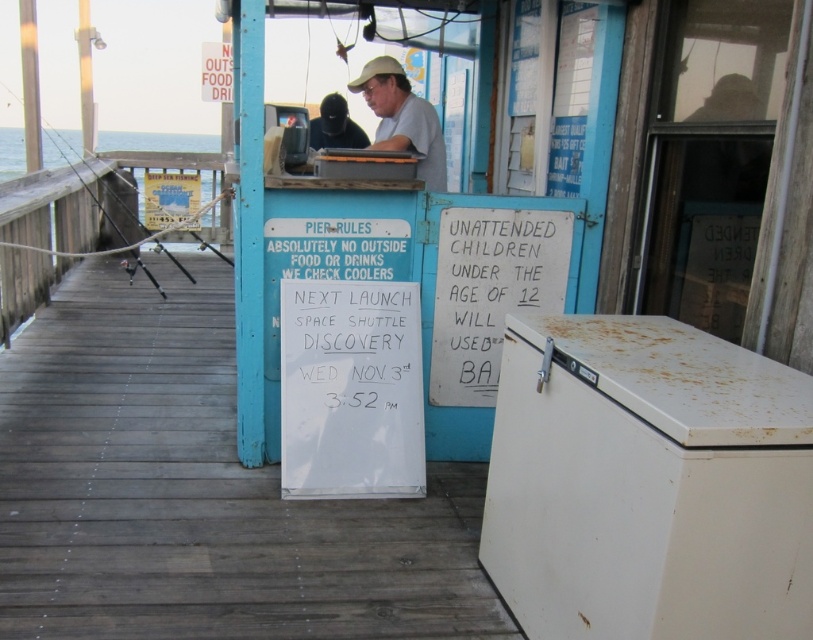
Does black plastic fishing pole at left appear on the left side of matte black jacket at upper center?

Indeed, black plastic fishing pole at left is positioned on the left side of matte black jacket at upper center.

Who is more distant from viewer, (x=96, y=200) or (x=329, y=125)?

The point (x=96, y=200) is behind.

Measure the distance between point [83,186] and camera.

Point [83,186] and camera are 6.42 meters apart from each other.

Identify the location of black plastic fishing pole at left. (72, 163).

Between white wood dock at center and black plastic fishing pole at left, which one is positioned higher?

black plastic fishing pole at left is higher up.

Which is in front, point (142, 384) or point (64, 168)?

Positioned in front is point (142, 384).

Between point (255, 544) and point (89, 168), which one is positioned behind?

The point (89, 168) is behind.

The width and height of the screenshot is (813, 640). I want to click on white wood dock at center, so click(198, 492).

Is matte khaki hat at upper center further to camera compared to black plastic fishing pole at left?

No, matte khaki hat at upper center is closer to the viewer.

Can you confirm if matte khaki hat at upper center is bigger than black plastic fishing pole at left?

Incorrect, matte khaki hat at upper center is not larger than black plastic fishing pole at left.

The width and height of the screenshot is (813, 640). I want to click on matte khaki hat at upper center, so click(x=402, y=118).